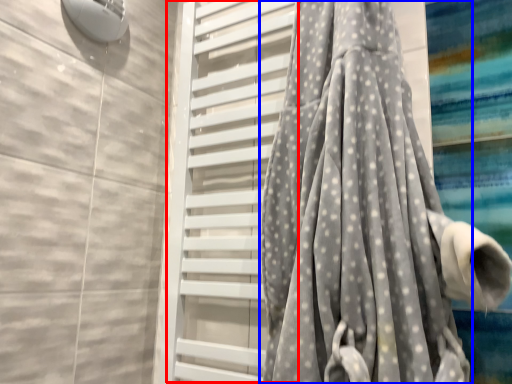
Question: Which point is closer to the camera, screen door (highlighted by a red box) or curtain (highlighted by a blue box)?

Choices:
 (A) screen door
 (B) curtain

Answer: (B)